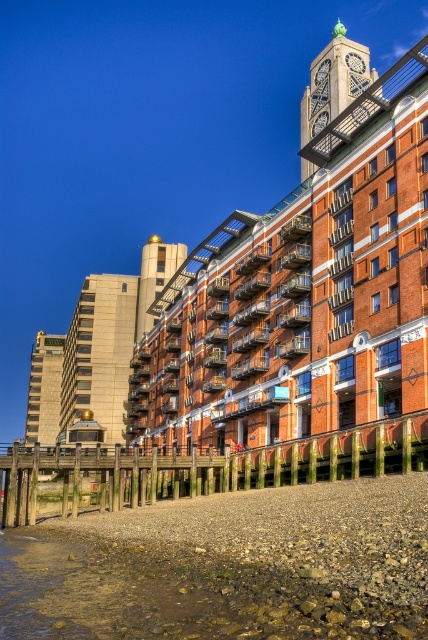
Which of these two, brick building at center or beige stone tower at left, stands shorter?

Standing shorter between the two is beige stone tower at left.

What do you see at coordinates (305, 282) in the screenshot? I see `brick building at center` at bounding box center [305, 282].

You are a GUI agent. You are given a task and a screenshot of the screen. Output one action in this format:
    pyautogui.click(x=<x>, y=<y>)
    Task: Click on the brick building at center
    This screenshot has width=428, height=640.
    Given the screenshot: What is the action you would take?
    pyautogui.click(x=305, y=282)

Who is taller, brick building at center or gold metallic tower at upper center?

brick building at center

Between brick building at center and gold metallic tower at upper center, which one appears on the left side from the viewer's perspective?

From the viewer's perspective, gold metallic tower at upper center appears more on the left side.

At what (x,y) coordinates should I click in order to perform the action: click on brick building at center. Please return your answer as a coordinate pair (x, y). This screenshot has width=428, height=640. Looking at the image, I should click on (305, 282).

Which is behind, point (412, 120) or point (35, 362)?

Positioned behind is point (35, 362).

Who is positioned more to the left, brick building at center or gold polished metal clock tower at center?

gold polished metal clock tower at center

Who is more distant from viewer, (412, 72) or (39, 417)?

Positioned behind is point (39, 417).

Find the location of `brick building at center`. brick building at center is located at coordinates (305, 282).